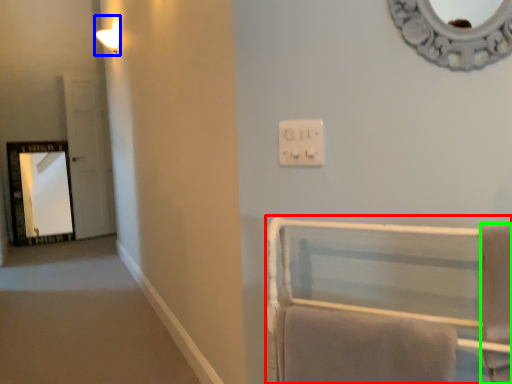
Question: Which object is positioned closest to furniture (highlighted by a red box)? Select from light fixture (highlighted by a blue box) and bath towel (highlighted by a green box).

Choices:
 (A) light fixture
 (B) bath towel

Answer: (B)